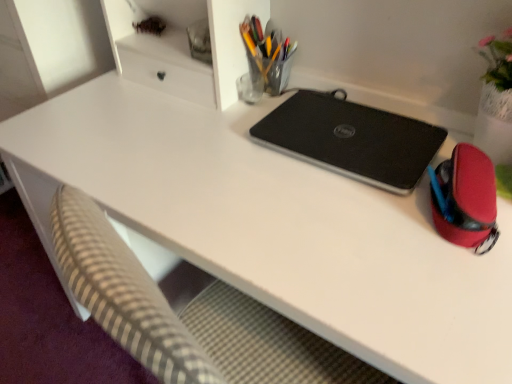
Find the location of `empty space that is ontop of rubberized red pouch at right, which ranks as the second stationery in top-to-bottom order (from a real-world perspective)`. empty space that is ontop of rubberized red pouch at right, which ranks as the second stationery in top-to-bottom order (from a real-world perspective) is located at coordinates [x=468, y=170].